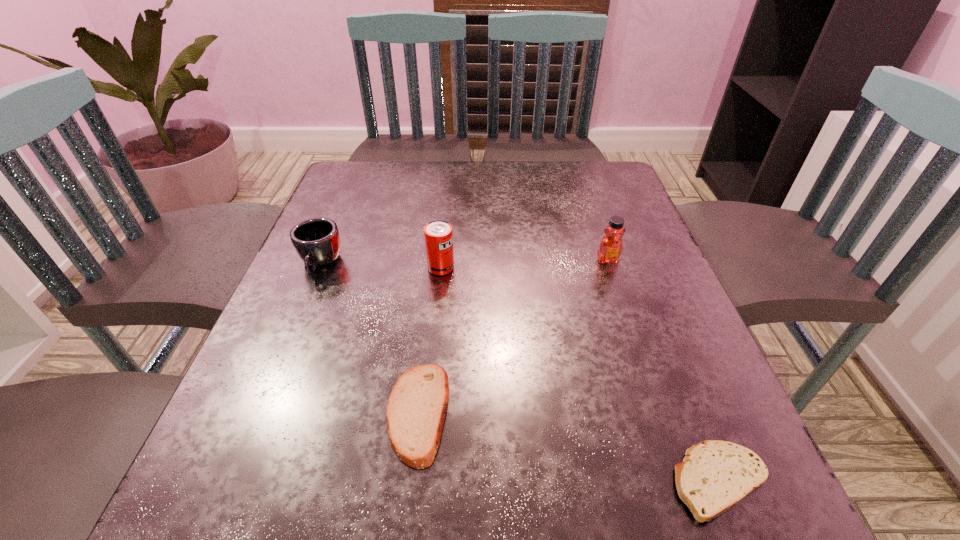
Locate an element on the screen. The width and height of the screenshot is (960, 540). free point at the right edge is located at coordinates (648, 287).

Locate an element on the screen. The width and height of the screenshot is (960, 540). free point at the far left corner is located at coordinates (379, 186).

The image size is (960, 540). In the image, there is a desktop. In order to click on vacant region at the far right corner in this screenshot , I will do `click(590, 208)`.

You are a GUI agent. You are given a task and a screenshot of the screen. Output one action in this format:
    pyautogui.click(x=<x>, y=<y>)
    Task: Click on the free space between the can and the right pita bread
    
    Given the screenshot: What is the action you would take?
    pyautogui.click(x=580, y=374)

At what (x,y) coordinates should I click in order to perform the action: click on empty space that is in between the honey and the mug. Please return your answer as a coordinate pair (x, y). Looking at the image, I should click on pos(464,262).

The height and width of the screenshot is (540, 960). Identify the location of free point between the fourth tallest object and the right pita bread. (569, 447).

Identify the location of free space between the mug and the honey. The image size is (960, 540). (464, 262).

Where is `free point between the left pita bread and the shortest object`? This screenshot has width=960, height=540. free point between the left pita bread and the shortest object is located at coordinates (569, 447).

Find the location of a particular element. free spot between the fourth tallest object and the mug is located at coordinates (369, 338).

Find the location of `free spot between the honey and the left pita bread`. free spot between the honey and the left pita bread is located at coordinates (513, 336).